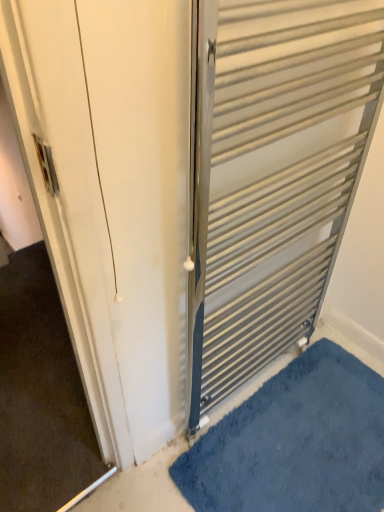
Question: Does metallic silver radiator at right have a greater height compared to blue shaggy bath mat at lower right?

Choices:
 (A) no
 (B) yes

Answer: (B)

Question: Does metallic silver radiator at right have a greater width compared to blue shaggy bath mat at lower right?

Choices:
 (A) yes
 (B) no

Answer: (B)

Question: From the image's perspective, is metallic silver radiator at right on blue shaggy bath mat at lower right?

Choices:
 (A) no
 (B) yes

Answer: (B)

Question: From a real-world perspective, is metallic silver radiator at right physically below blue shaggy bath mat at lower right?

Choices:
 (A) no
 (B) yes

Answer: (A)

Question: From a real-world perspective, does metallic silver radiator at right stand above blue shaggy bath mat at lower right?

Choices:
 (A) no
 (B) yes

Answer: (B)

Question: Is metallic silver radiator at right looking in the opposite direction of blue shaggy bath mat at lower right?

Choices:
 (A) yes
 (B) no

Answer: (B)

Question: Is blue shaggy bath mat at lower right closer to the viewer compared to metallic silver radiator at right?

Choices:
 (A) yes
 (B) no

Answer: (B)

Question: From a real-world perspective, is blue shaggy bath mat at lower right located beneath metallic silver radiator at right?

Choices:
 (A) yes
 (B) no

Answer: (A)

Question: Considering the relative sizes of blue shaggy bath mat at lower right and metallic silver radiator at right in the image provided, is blue shaggy bath mat at lower right thinner than metallic silver radiator at right?

Choices:
 (A) yes
 (B) no

Answer: (B)

Question: Can you confirm if blue shaggy bath mat at lower right is smaller than metallic silver radiator at right?

Choices:
 (A) yes
 (B) no

Answer: (A)

Question: Could you tell me if blue shaggy bath mat at lower right is facing metallic silver radiator at right?

Choices:
 (A) no
 (B) yes

Answer: (A)

Question: From the image's perspective, is blue shaggy bath mat at lower right beneath metallic silver radiator at right?

Choices:
 (A) no
 (B) yes

Answer: (B)

Question: Would you say metallic silver radiator at right is to the left or to the right of blue shaggy bath mat at lower right in the picture?

Choices:
 (A) left
 (B) right

Answer: (A)